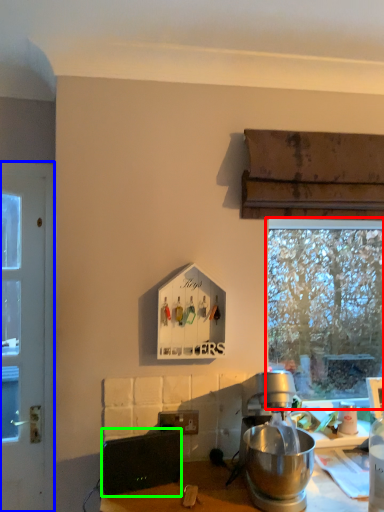
Question: Based on their relative distances, which object is farther from window (highlighted by a red box)? Choose from door (highlighted by a blue box) and appliance (highlighted by a green box).

Choices:
 (A) door
 (B) appliance

Answer: (A)